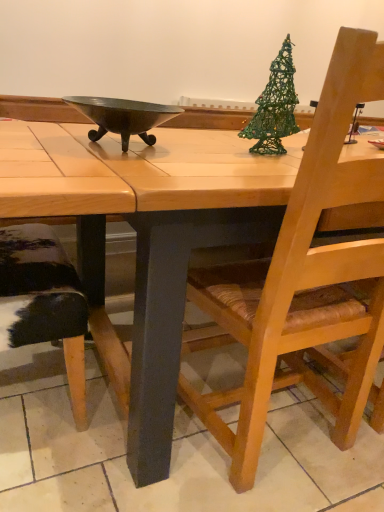
The image size is (384, 512). What are the coordinates of `free spot to the left of metallic dark gray bowl at center` in the screenshot? It's located at (31, 136).